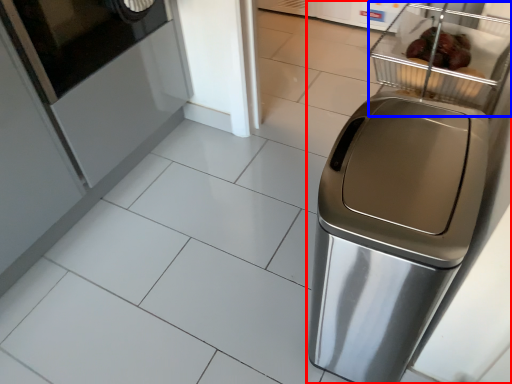
Question: Which of the following is the closest to the observer, home appliance (highlighted by a red box) or basket (highlighted by a blue box)?

Choices:
 (A) home appliance
 (B) basket

Answer: (A)